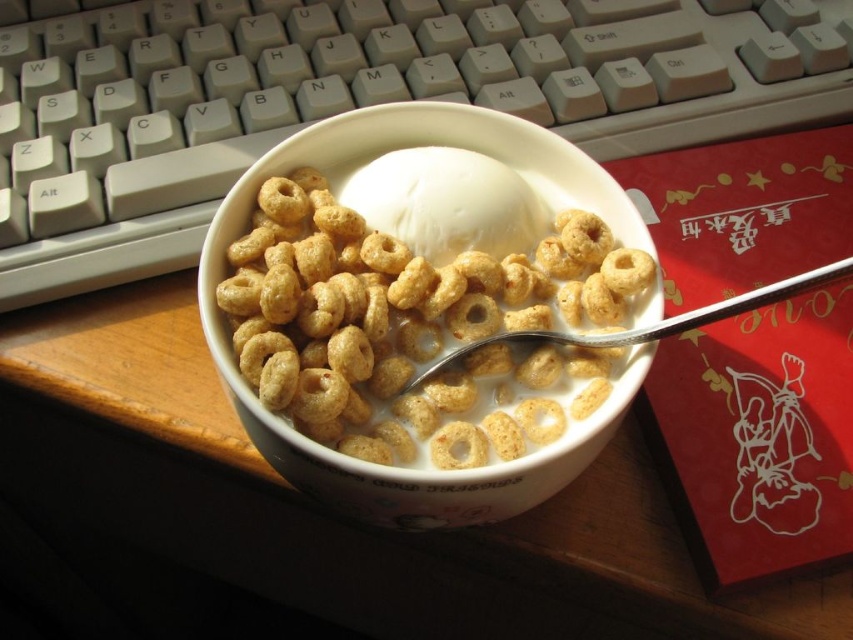
Question: Which is farther from the white plastic keyboard at upper center?

Choices:
 (A) white creamy ice cream at center
 (B) golden matte cereal at center

Answer: (B)

Question: Does white creamy ice cream at center appear under satin silver spoon at center?

Choices:
 (A) yes
 (B) no

Answer: (B)

Question: Which point is closer to the camera?

Choices:
 (A) satin silver spoon at center
 (B) white creamy ice cream at center

Answer: (A)

Question: Which object is the closest to the white creamy ice cream at center?

Choices:
 (A) white plastic keyboard at upper center
 (B) satin silver spoon at center
 (C) golden matte cereal at center

Answer: (C)

Question: Is golden matte cereal at center wider than white creamy ice cream at center?

Choices:
 (A) no
 (B) yes

Answer: (B)

Question: Does golden matte cereal at center come in front of satin silver spoon at center?

Choices:
 (A) yes
 (B) no

Answer: (B)